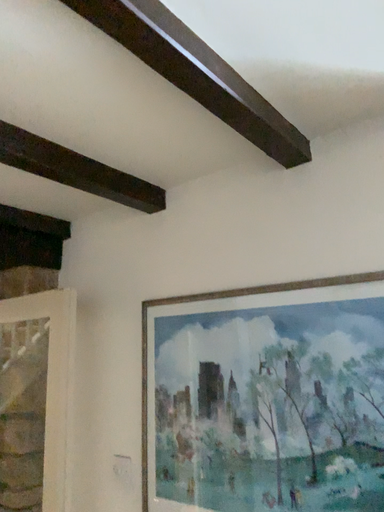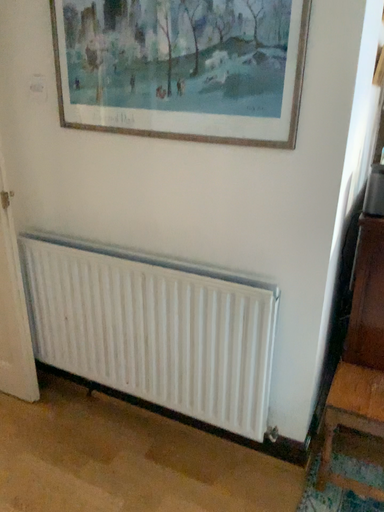
Question: Which way did the camera rotate in the video?

Choices:
 (A) rotated upward
 (B) rotated downward

Answer: (B)